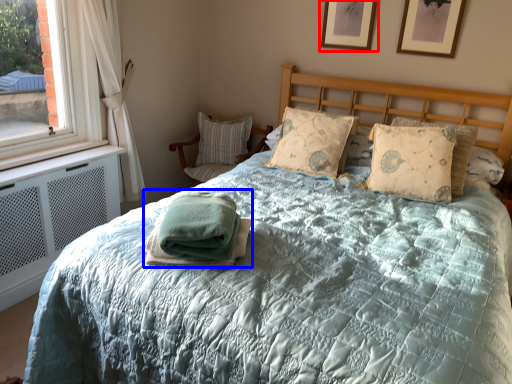
Question: Which object is closer to the camera taking this photo, picture frame (highlighted by a red box) or blanket (highlighted by a blue box)?

Choices:
 (A) picture frame
 (B) blanket

Answer: (B)